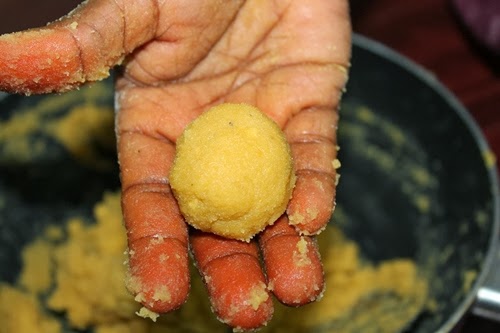
At what (x,y) coordinates should I click in order to perform the action: click on table. Please return your answer as a coordinate pair (x, y). Image resolution: width=500 pixels, height=333 pixels. Looking at the image, I should click on (428, 25).